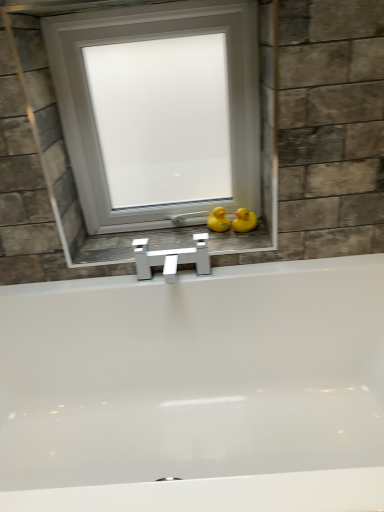
This screenshot has width=384, height=512. I want to click on free region on the left part of yellow rubber duck at center, the first duck in the left-to-right sequence, so click(172, 239).